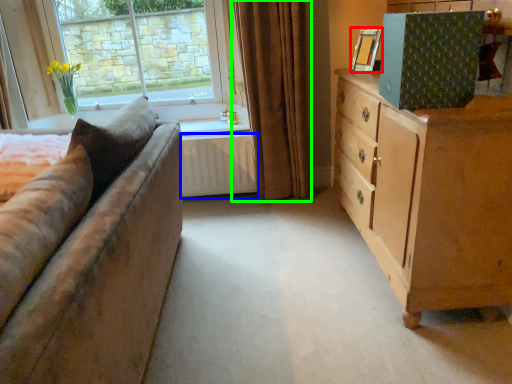
Question: Which object is the farthest from picture frame (highlighted by a red box)? Choose among these: radiator (highlighted by a blue box) or curtain (highlighted by a green box).

Choices:
 (A) radiator
 (B) curtain

Answer: (A)